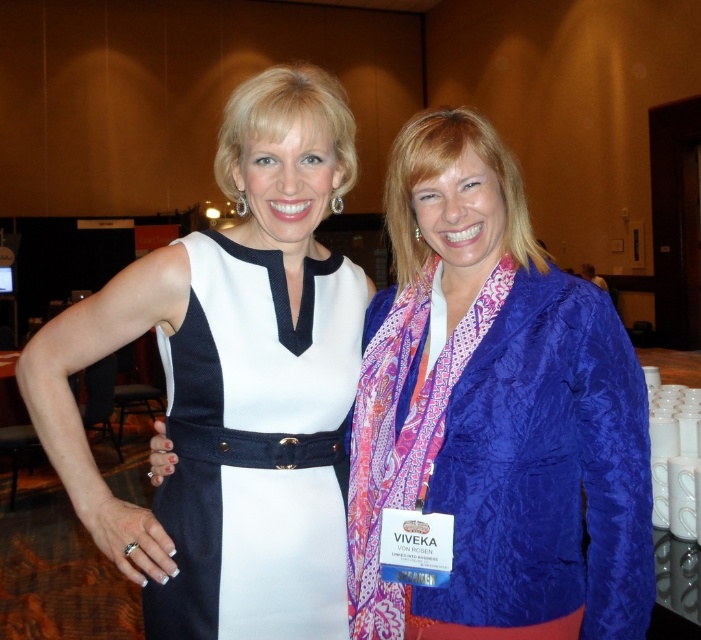
Is blue silk blazer at center shorter than white fabric dress at center?

Indeed, blue silk blazer at center has a lesser height compared to white fabric dress at center.

Does point (540, 346) come closer to viewer compared to point (233, 280)?

Yes.

Identify the location of blue silk blazer at center. This screenshot has width=701, height=640. (494, 413).

At what (x,y) coordinates should I click in order to perform the action: click on blue silk blazer at center. Please return your answer as a coordinate pair (x, y). Looking at the image, I should click on (494, 413).

This screenshot has height=640, width=701. I want to click on blue silk blazer at center, so click(x=494, y=413).

Is white fabric dress at center closer to camera compared to white textured fabric dress at left?

Yes, it is.

Is point (170, 380) more distant than point (217, 356)?

Yes.

You are a GUI agent. You are given a task and a screenshot of the screen. Output one action in this format:
    pyautogui.click(x=<x>, y=<y>)
    Task: Click on the white fabric dress at center
    
    Given the screenshot: What is the action you would take?
    pyautogui.click(x=231, y=384)